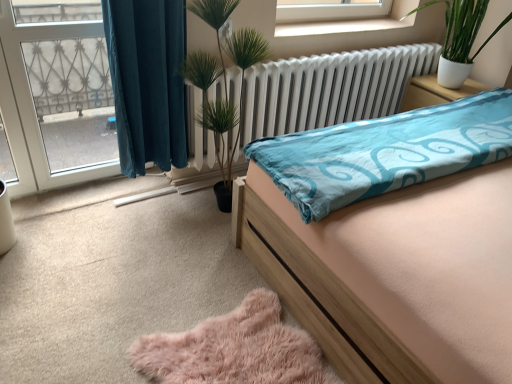
You are a GUI agent. You are given a task and a screenshot of the screen. Output one action in this format:
    pyautogui.click(x=<x>, y=<y>)
    Task: Click on the free space in front of transparent glass door at left
    
    Given the screenshot: What is the action you would take?
    pyautogui.click(x=55, y=222)